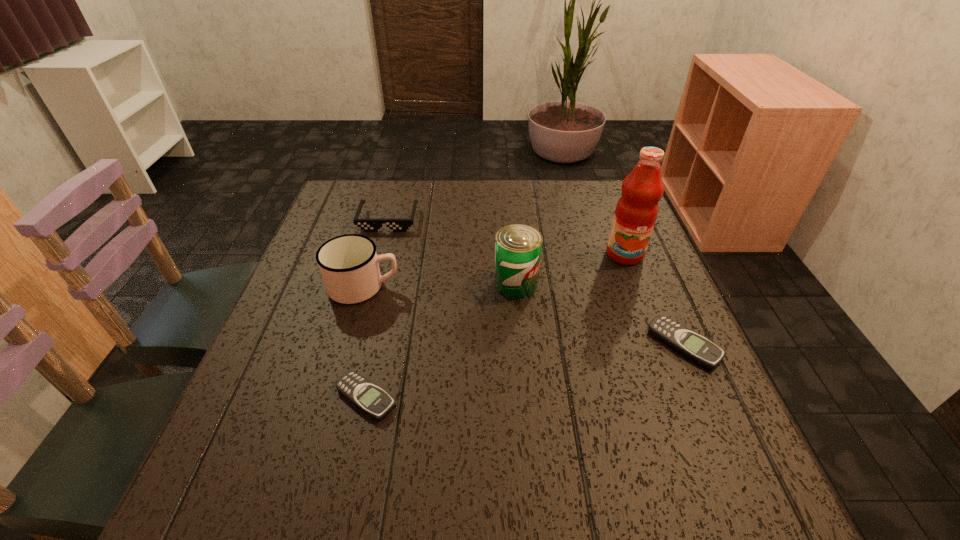
Locate an element on the screen. This screenshot has width=960, height=540. the fifth shortest object is located at coordinates (518, 247).

Find the location of a particular element. This screenshot has height=540, width=960. free space located 0.060m on the left of the shorter beeper is located at coordinates (301, 398).

Locate an element on the screen. free space located 0.110m on the left of the fifth farthest object is located at coordinates (599, 345).

Image resolution: width=960 pixels, height=540 pixels. I want to click on free spot located on the front-facing side of the farthest object, so click(x=366, y=302).

This screenshot has height=540, width=960. In order to click on vacant point located 0.070m on the side of the mug with the handle in this screenshot , I will do `click(429, 287)`.

Image resolution: width=960 pixels, height=540 pixels. Identify the location of vacant space located 0.340m on the front label of the fruit juice. (674, 382).

Locate an element on the screen. This screenshot has width=960, height=540. free space located 0.120m on the left of the can is located at coordinates (444, 284).

The width and height of the screenshot is (960, 540). Find the location of `object situated at the far edge`. object situated at the far edge is located at coordinates (368, 225).

The width and height of the screenshot is (960, 540). Identify the location of object that is at the near edge. (367, 396).

At what (x,y) coordinates should I click in order to perform the action: click on sunglasses situated at the left edge. Please return your answer as a coordinate pair (x, y). The height and width of the screenshot is (540, 960). Looking at the image, I should click on (368, 225).